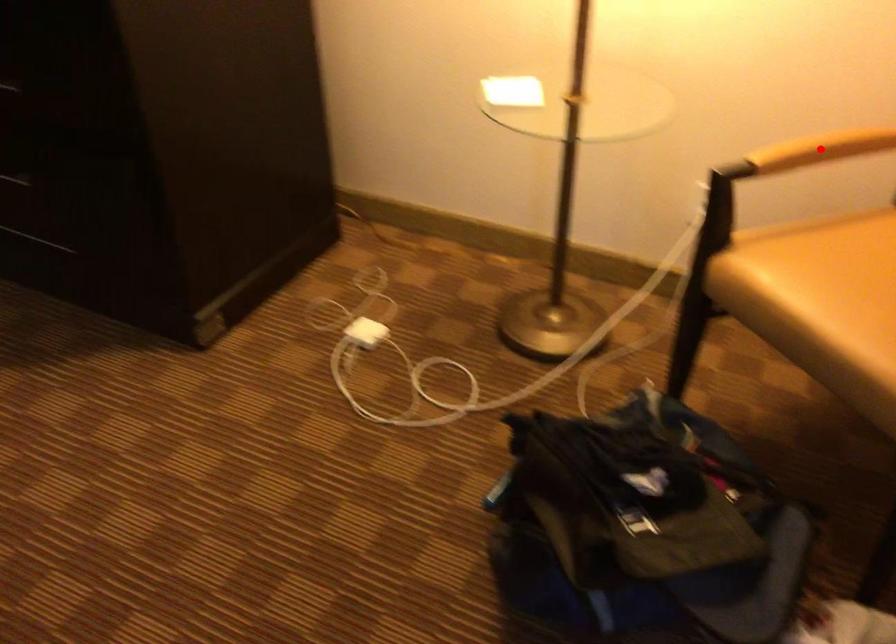
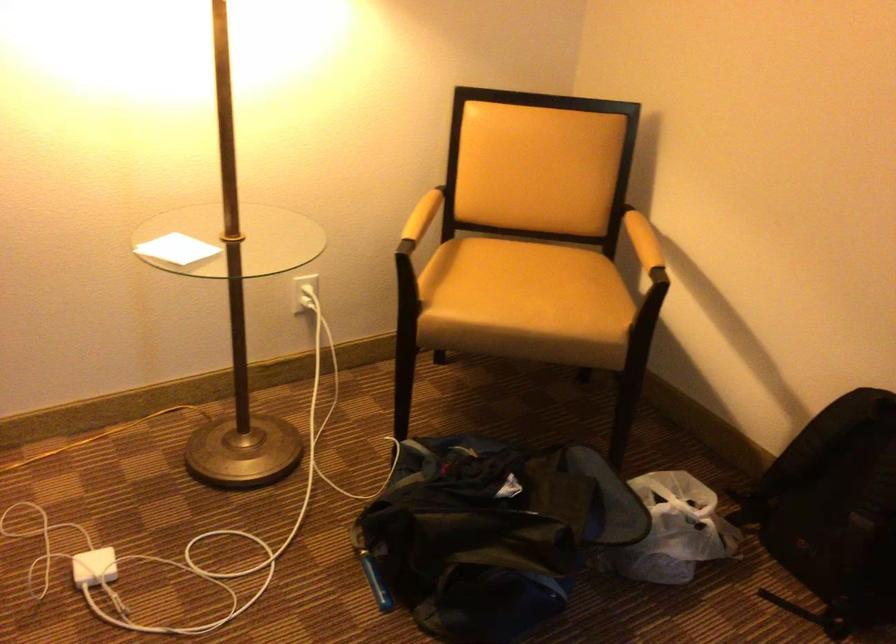
Locate, in the second image, the point that corresponds to the highlighted location in the first image.

(437, 216)